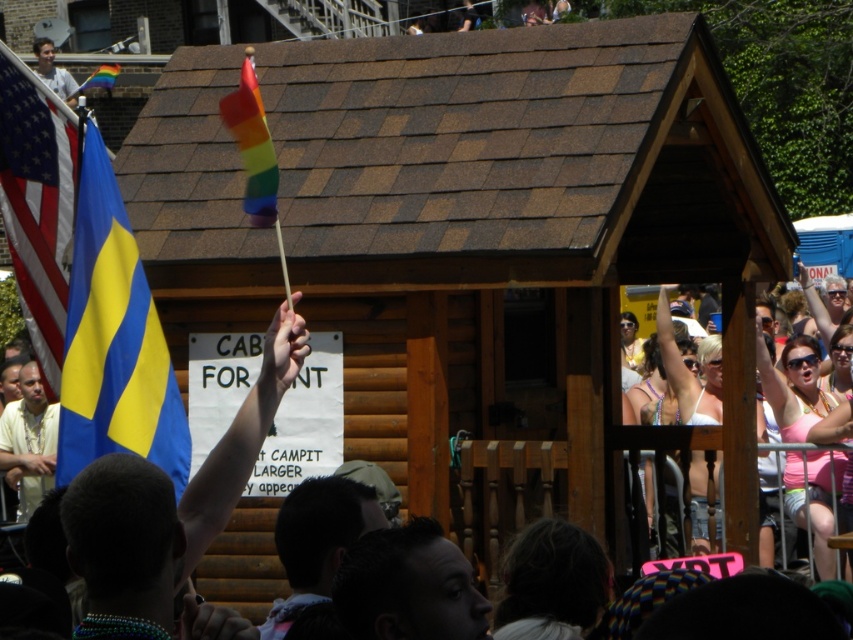
You are standing at the CAB FOR NT cabin in the center of the parade. You notice two points marked in the image. The first point is at coordinates point (67,304) and the second is at point (74,125). If you want to move towards the point that is closer to you, which coordinate should you head towards?

Point (67,304) is in front of point (74,125), so you should head towards point (67,304) as it is closer to your current position at the CAB FOR NT cabin.